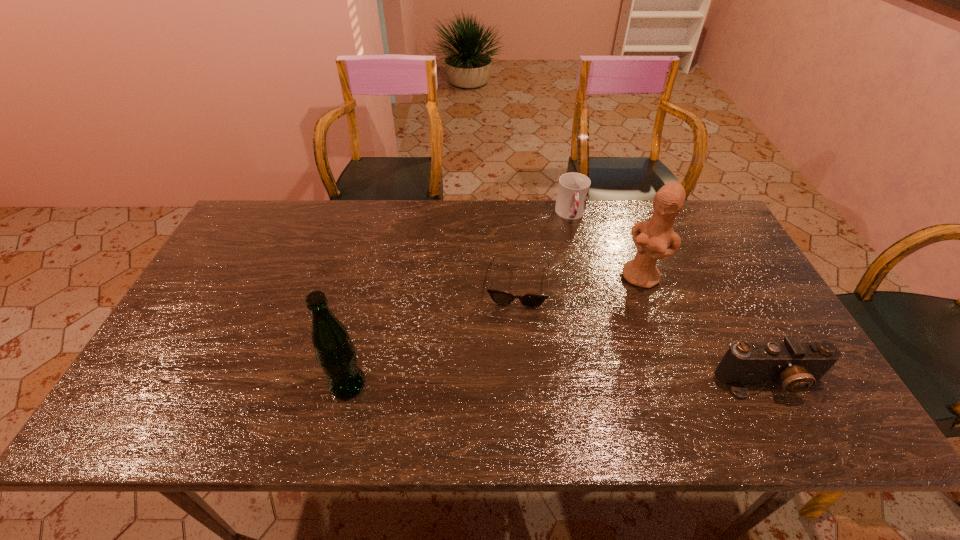
You are a GUI agent. You are given a task and a screenshot of the screen. Output one action in this format:
    pyautogui.click(x=<x>, y=<y>)
    Task: Click on the free spot between the figurine and the cup
    The height and width of the screenshot is (540, 960).
    Given the screenshot: What is the action you would take?
    pyautogui.click(x=607, y=246)

The image size is (960, 540). In order to click on free space between the figurine and the camera in this screenshot , I will do coord(706,329).

Locate an element on the screen. This screenshot has height=540, width=960. free space between the third object from right to left and the fourth object from right to left is located at coordinates (544, 249).

Identify the location of free area in between the figurine and the leftmost object. Image resolution: width=960 pixels, height=540 pixels. (495, 331).

Locate an element on the screen. The image size is (960, 540). vacant space that is in between the sunglasses and the second object from right to left is located at coordinates (581, 281).

Find the location of `empty location between the leftmost object and the fourth object from left to right`. empty location between the leftmost object and the fourth object from left to right is located at coordinates (495, 331).

Identify the location of unoccupied area between the leftmost object and the third object from right to left. Image resolution: width=960 pixels, height=540 pixels. (459, 300).

Locate which object ranks fourth in proximity to the camera. Please provide its 2D coordinates. Your answer should be formatted as a tuple, i.e. [(x, y)], where the tuple contains the x and y coordinates of a point satisfying the conditions above.

[(335, 352)]

Identify which object is located as the third nearest to the leftmost object. Please provide its 2D coordinates. Your answer should be formatted as a tuple, i.e. [(x, y)], where the tuple contains the x and y coordinates of a point satisfying the conditions above.

[(573, 188)]